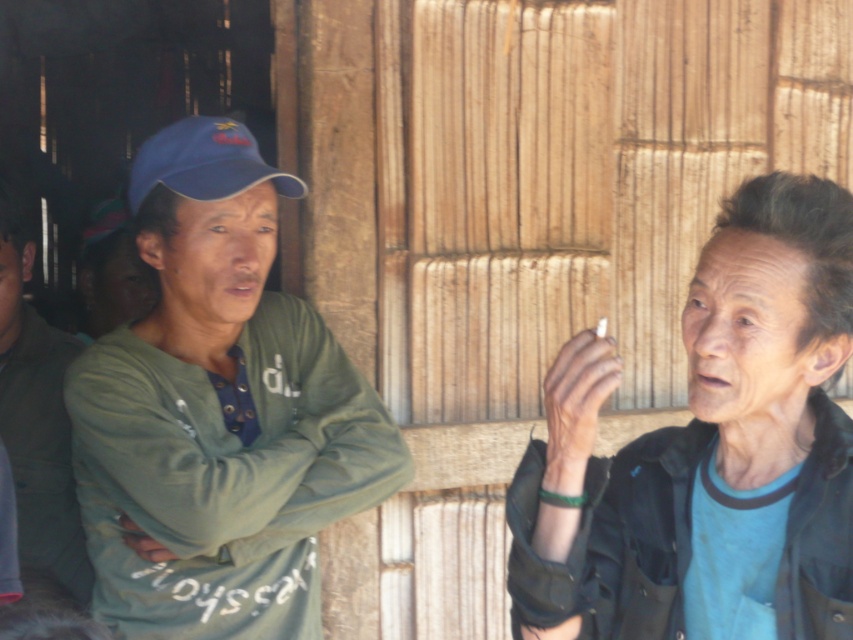
Question: Which point is farther to the camera?

Choices:
 (A) blue fabric shirt at right
 (B) blue fabric baseball cap at upper left
 (C) green matte shirt at left

Answer: (B)

Question: Which is farther from the blue fabric shirt at right?

Choices:
 (A) blue fabric baseball cap at upper left
 (B) green matte shirt at left
 (C) green matte jacket at left

Answer: (C)

Question: Does green matte shirt at left have a lesser width compared to green matte jacket at left?

Choices:
 (A) no
 (B) yes

Answer: (A)

Question: Which point is closer to the camera taking this photo?

Choices:
 (A) (57, 374)
 (B) (335, 365)

Answer: (B)

Question: Can you confirm if green matte shirt at left is positioned below blue fabric baseball cap at upper left?

Choices:
 (A) no
 (B) yes

Answer: (B)

Question: From the image, what is the correct spatial relationship of green matte jacket at left in relation to blue fabric baseball cap at upper left?

Choices:
 (A) above
 (B) below

Answer: (B)